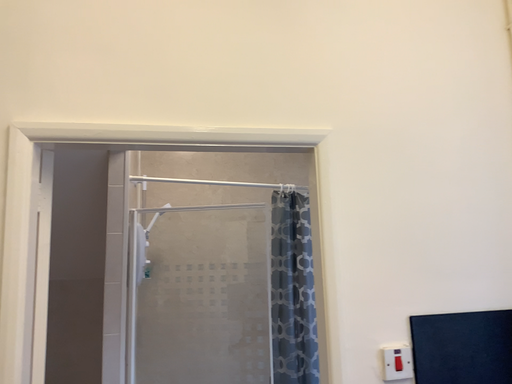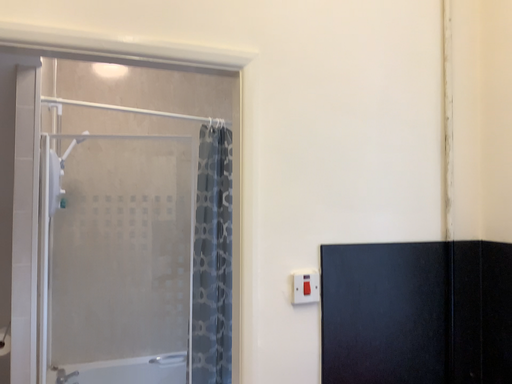
Question: How did the camera likely rotate when shooting the video?

Choices:
 (A) rotated left
 (B) rotated right

Answer: (B)